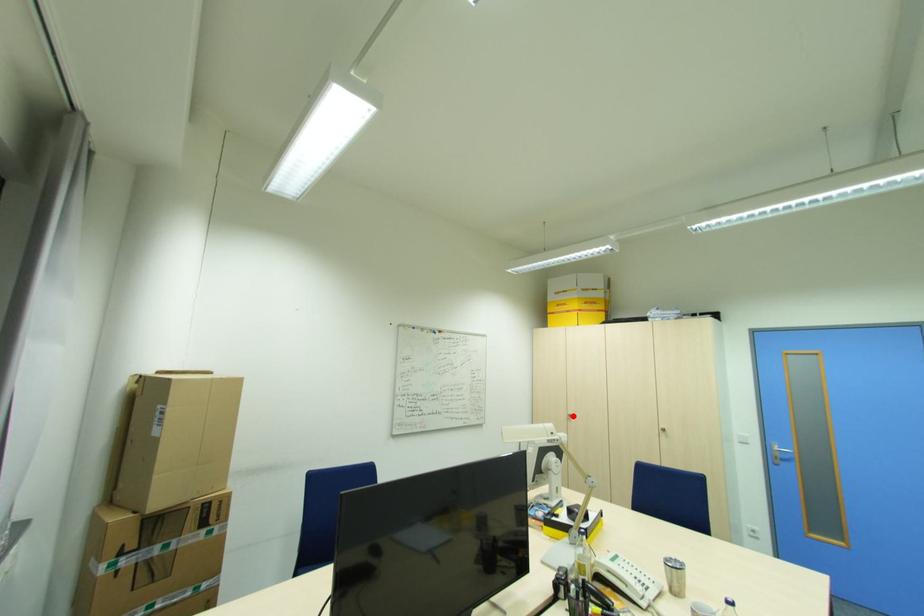
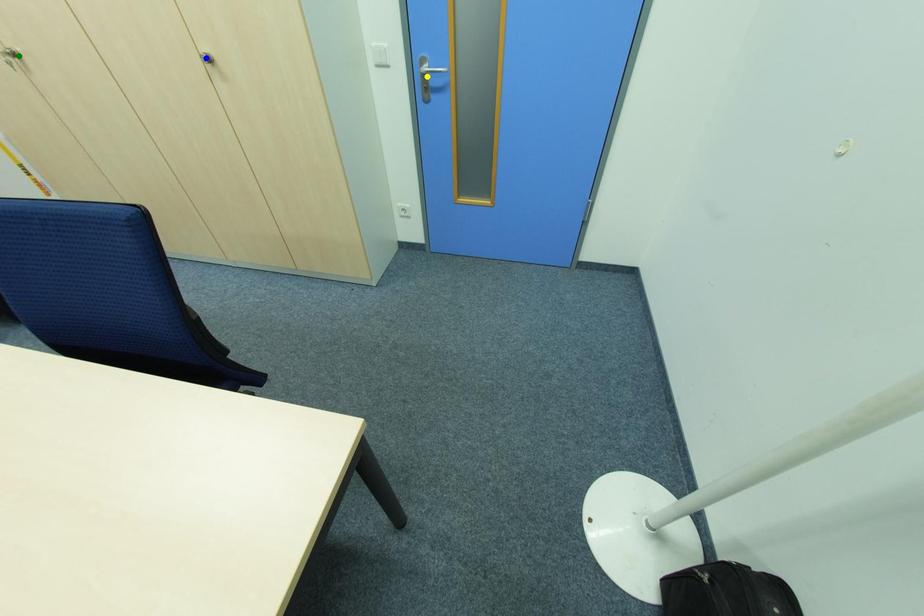
Question: I am providing you with two images of the same scene from different viewpoints. A red point is marked on the first image. You are given multiple points on the second image. Which point in image 2 is actually the same real-world point as the red point in image 1?

Choices:
 (A) blue point
 (B) yellow point
 (C) green point

Answer: (C)